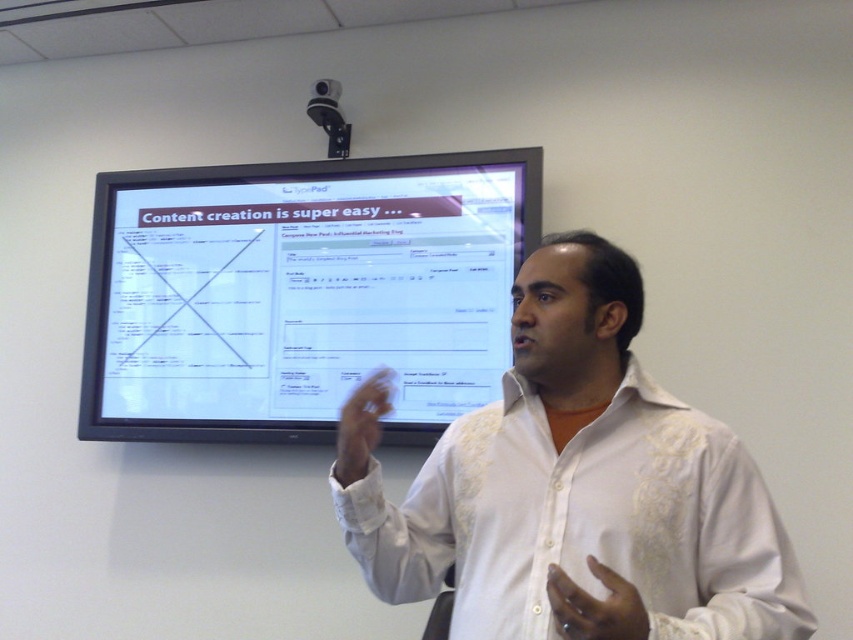
You are an AI assistant analyzing the image. The man in the image is wearing a white shirt with embroidery. There is a point at coordinates (582,483). Can you determine what object in the image this point corresponds to?

The point at coordinates (582,483) corresponds to the white embroidered shirt at center.